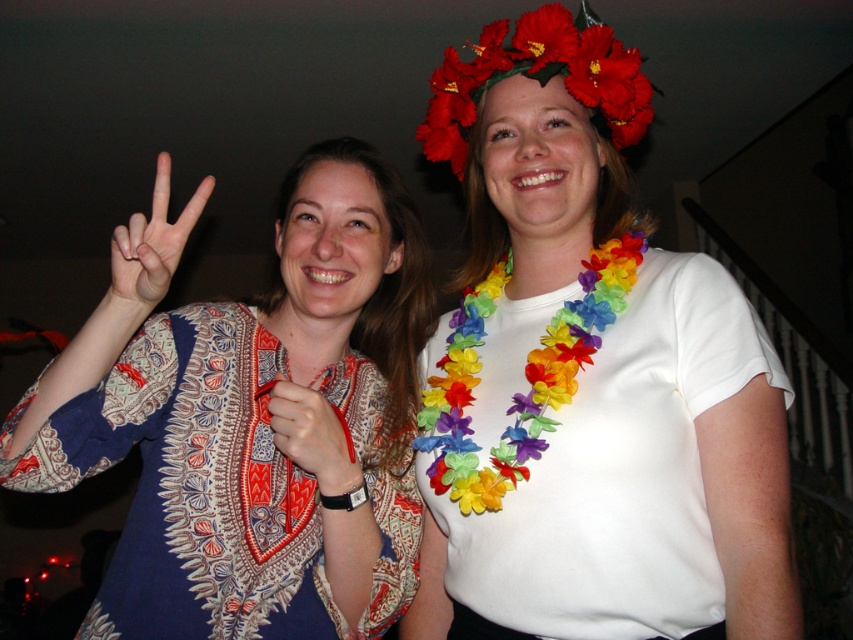
Please provide the 2D coordinates of the patterned fabric shirt at center in the image using the coordinate system where the bottom left corner is the origin point. The coordinates should be in the format of a tuple with two decimal numbers separated by a comma, such as 0.5,0.5.

The 2D coordinates of the patterned fabric shirt at center are at point (251, 417).

You are standing in the room where the two people are posing. You want to place a small decoration exactly halfway between the point at (616,102) and the point at (450,429). Will this decoration be closer to the person on the left or the right?

The decoration placed halfway between point (616,102) and point (450,429) will be closer to the person on the right because the midpoint between these coordinates is closer to the right point.

You are a photographer holding a camera with a 5.00 inch lens. You want to capture both the matte white hand at center and the matte fabric hand at center in the same frame. Can you position the camera so that both hands are within the lens view without moving the subjects?

The matte white hand at center and matte fabric hand at center are 9.00 inches apart. Since the lens is 5.00 inches wide, which is smaller than the distance between the hands, the camera cannot fit both hands into the frame simultaneously without moving the subjects.